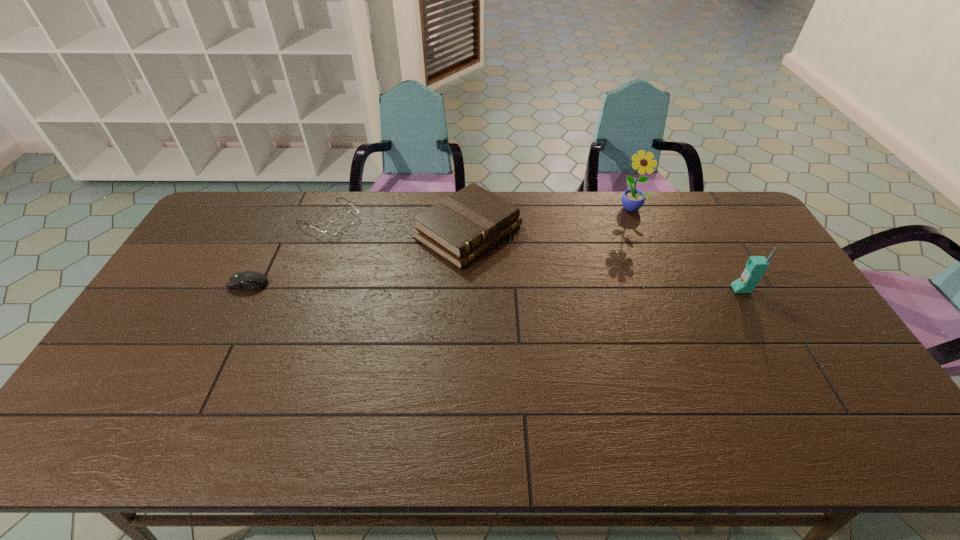
Locate an element on the screen. the shortest object is located at coordinates (253, 281).

Locate an element on the screen. The image size is (960, 540). the rightmost object is located at coordinates (756, 266).

Where is `cellular telephone`? cellular telephone is located at coordinates (756, 266).

Where is `the fourth object from left to right`? The width and height of the screenshot is (960, 540). the fourth object from left to right is located at coordinates pos(632,199).

This screenshot has width=960, height=540. In order to click on sunflower in this screenshot , I will do `click(632, 199)`.

Locate an element on the screen. the third object from right to left is located at coordinates (459, 228).

The height and width of the screenshot is (540, 960). What are the coordinates of `the third tallest object` in the screenshot? It's located at (459, 228).

The height and width of the screenshot is (540, 960). Identify the location of the fourth tallest object. (333, 227).

Locate an element on the screen. This screenshot has width=960, height=540. vacant space situated 0.050m on the button of the shortest object is located at coordinates (213, 284).

The width and height of the screenshot is (960, 540). In order to click on vacant area located 0.190m on the button of the shortest object in this screenshot , I will do `click(167, 284)`.